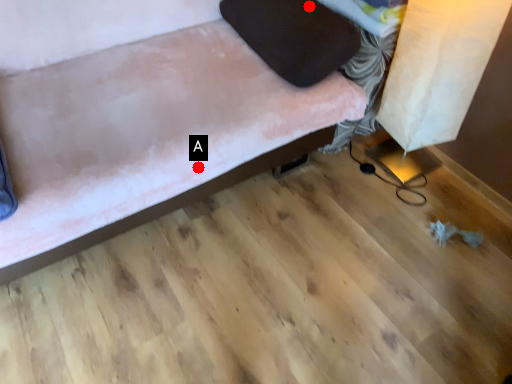
Question: Two points are circled on the image, labeled by A and B beside each circle. Among these points, which one is nearest to the camera?

Choices:
 (A) A is closer
 (B) B is closer

Answer: (A)